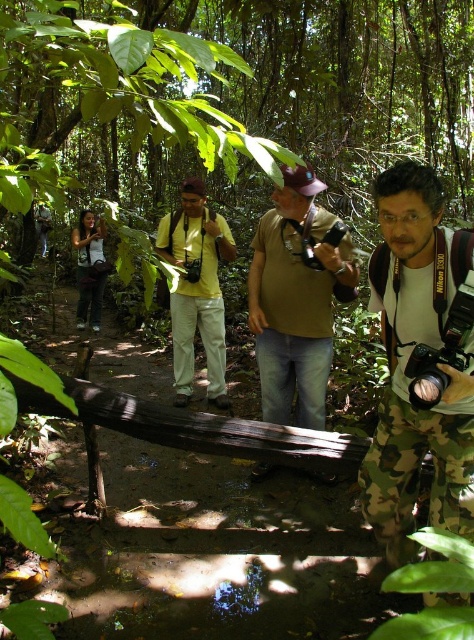
Question: Which object is the closest to the matte black camera at left?

Choices:
 (A) yellow matte shirt at center
 (B) camo pants at center

Answer: (A)

Question: Which is farther from the black plastic camera at center?

Choices:
 (A) matte black camera at left
 (B) yellow matte shirt at center
 (C) brown matte shirt at center

Answer: (A)

Question: Is yellow matte shirt at center wider than matte black camera at left?

Choices:
 (A) no
 (B) yes

Answer: (B)

Question: Among these points, which one is farthest from the camera?

Choices:
 (A) (178, 403)
 (B) (340, 291)
 (C) (401, 330)

Answer: (A)

Question: Does camo pants at center appear on the right side of black plastic camera at center?

Choices:
 (A) no
 (B) yes

Answer: (B)

Question: Does camo pants at center have a larger size compared to black plastic camera at center?

Choices:
 (A) yes
 (B) no

Answer: (A)